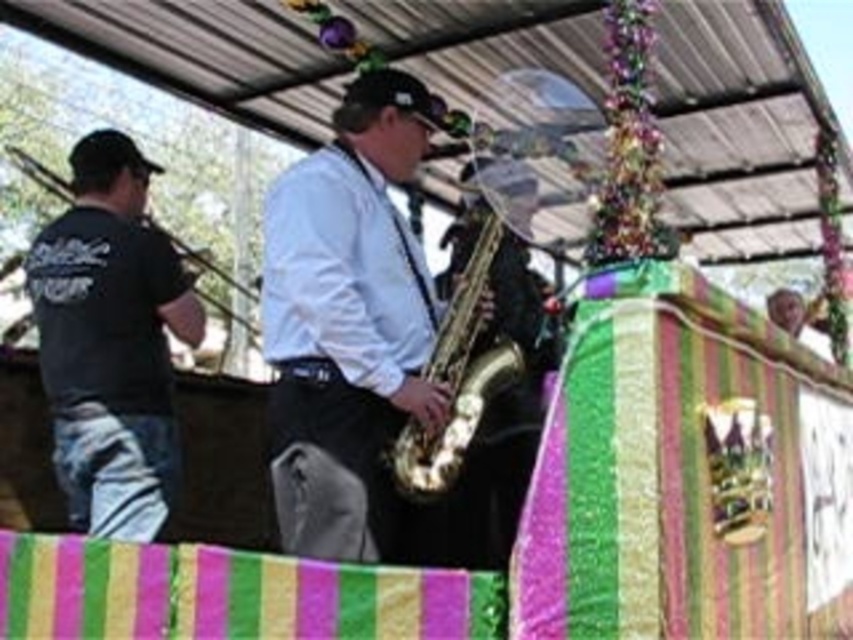
Question: Which object is the farthest from the gold shiny saxophone at center?

Choices:
 (A) black matte shirt at left
 (B) shiny gold saxophone at center

Answer: (A)

Question: Does shiny gold saxophone at center have a smaller size compared to gold shiny saxophone at center?

Choices:
 (A) yes
 (B) no

Answer: (B)

Question: Which point is farther from the camera taking this photo?

Choices:
 (A) (395, 460)
 (B) (108, 371)

Answer: (B)

Question: Is shiny gold saxophone at center smaller than black matte shirt at left?

Choices:
 (A) no
 (B) yes

Answer: (A)

Question: Among these points, which one is nearest to the camera?

Choices:
 (A) (80, 490)
 (B) (334, 291)
 (C) (479, 250)

Answer: (B)

Question: Can you confirm if shiny gold saxophone at center is positioned below black matte shirt at left?

Choices:
 (A) yes
 (B) no

Answer: (A)